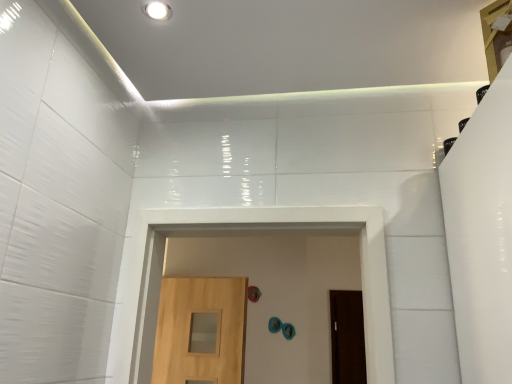
Question: Is light brown wood door at center, arranged as the second door when viewed from the back, not inside white glossy recessed light at upper center?

Choices:
 (A) no
 (B) yes

Answer: (B)

Question: Does light brown wood door at center, the first door from the front, appear on the right side of white glossy recessed light at upper center?

Choices:
 (A) yes
 (B) no

Answer: (B)

Question: Considering the relative sizes of light brown wood door at center, the first door from the front, and white glossy recessed light at upper center in the image provided, is light brown wood door at center, the first door from the front, taller than white glossy recessed light at upper center?

Choices:
 (A) no
 (B) yes

Answer: (B)

Question: Is light brown wood door at center, positioned as the 2th door in right-to-left order, positioned in front of white glossy recessed light at upper center?

Choices:
 (A) yes
 (B) no

Answer: (B)

Question: Can you confirm if light brown wood door at center, arranged as the second door when viewed from the back, is shorter than white glossy recessed light at upper center?

Choices:
 (A) yes
 (B) no

Answer: (B)

Question: Is light brown wood door at center, arranged as the second door when viewed from the back, in front of or behind white glossy recessed light at upper center in the image?

Choices:
 (A) behind
 (B) front

Answer: (A)

Question: Choose the correct answer: Is light brown wood door at center, positioned as the 2th door in right-to-left order, inside white glossy recessed light at upper center or outside it?

Choices:
 (A) outside
 (B) inside

Answer: (A)

Question: Considering the positions of light brown wood door at center, the first door from the front, and white glossy recessed light at upper center in the image, is light brown wood door at center, the first door from the front, taller or shorter than white glossy recessed light at upper center?

Choices:
 (A) short
 (B) tall

Answer: (B)

Question: From the image's perspective, relative to white glossy recessed light at upper center, is light brown wood door at center, the first door from the front, above or below?

Choices:
 (A) above
 (B) below

Answer: (B)

Question: In terms of width, does brown matte door at center, the 2th door in the front-to-back sequence, look wider or thinner when compared to white glossy recessed light at upper center?

Choices:
 (A) thin
 (B) wide

Answer: (A)

Question: From a real-world perspective, is brown matte door at center, the second door viewed from the left, physically located above or below white glossy recessed light at upper center?

Choices:
 (A) above
 (B) below

Answer: (B)

Question: Considering the positions of brown matte door at center, acting as the 1th door starting from the back, and white glossy recessed light at upper center in the image, is brown matte door at center, acting as the 1th door starting from the back, bigger or smaller than white glossy recessed light at upper center?

Choices:
 (A) small
 (B) big

Answer: (B)

Question: Visually, is brown matte door at center, acting as the 1th door starting from the back, positioned to the left or to the right of white glossy recessed light at upper center?

Choices:
 (A) left
 (B) right

Answer: (B)

Question: Considering the positions of point (162, 369) and point (340, 334), is point (162, 369) closer or farther from the camera than point (340, 334)?

Choices:
 (A) farther
 (B) closer

Answer: (B)

Question: Considering the positions of light brown wood door at center, arranged as the second door when viewed from the back, and brown matte door at center, the second door viewed from the left, in the image, is light brown wood door at center, arranged as the second door when viewed from the back, taller or shorter than brown matte door at center, the second door viewed from the left,?

Choices:
 (A) short
 (B) tall

Answer: (A)